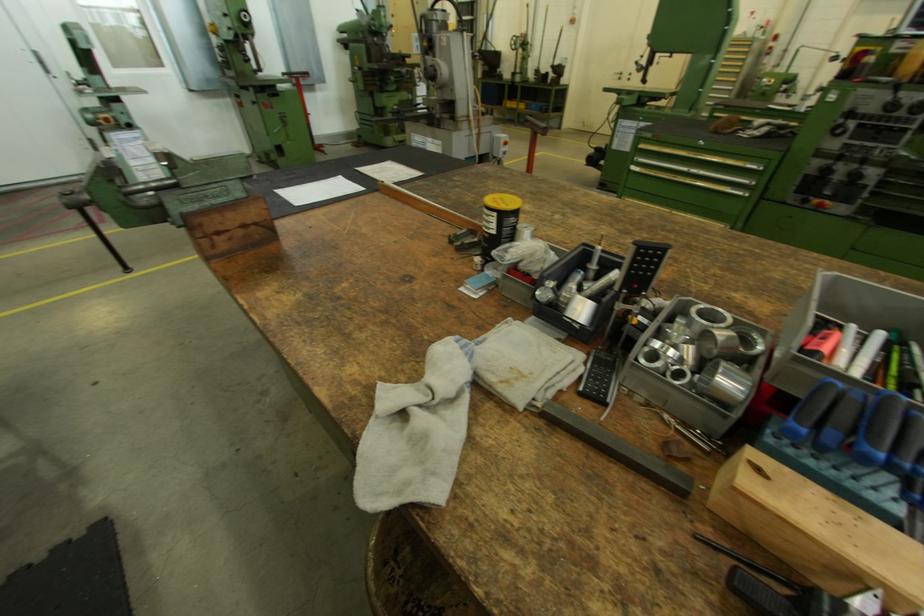
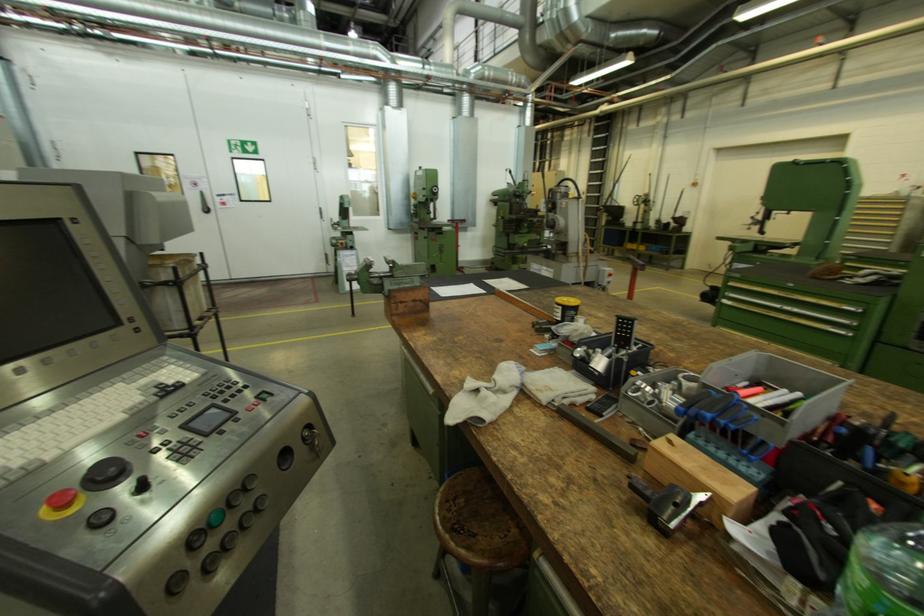
In a continuous first-person perspective shot, in which direction is the camera moving?

The movement direction of the cameraman is right, backward.